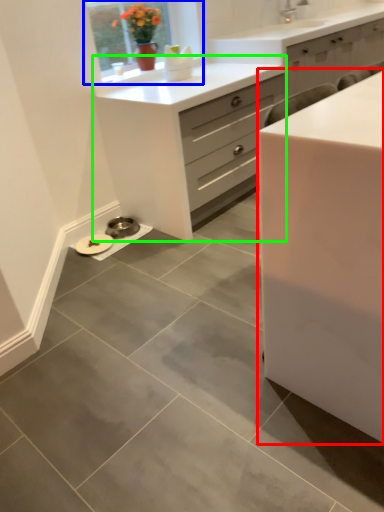
Question: Considering the real-world distances, which object is closest to chest of drawers (highlighted by a red box)? window (highlighted by a blue box) or chest of drawers (highlighted by a green box).

Choices:
 (A) window
 (B) chest of drawers

Answer: (B)